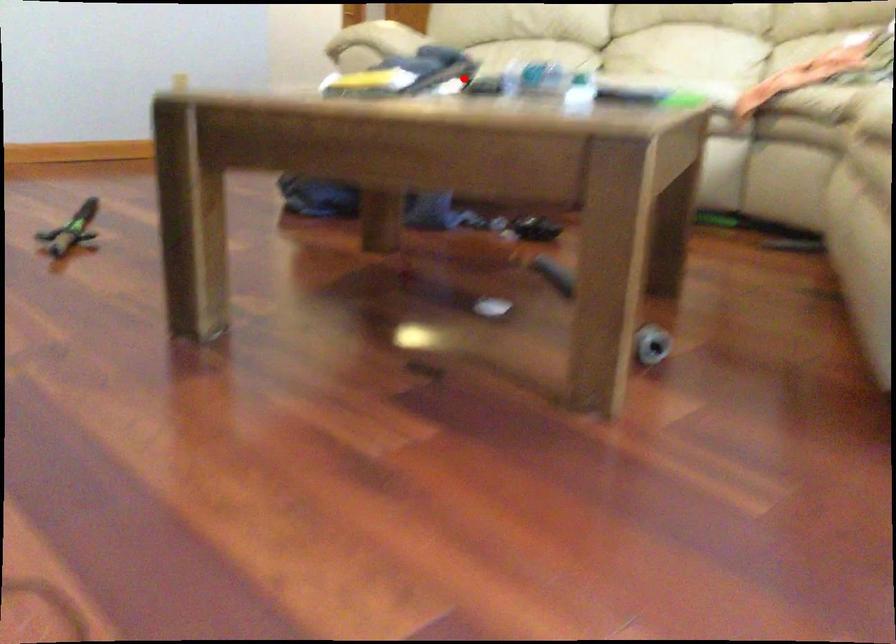
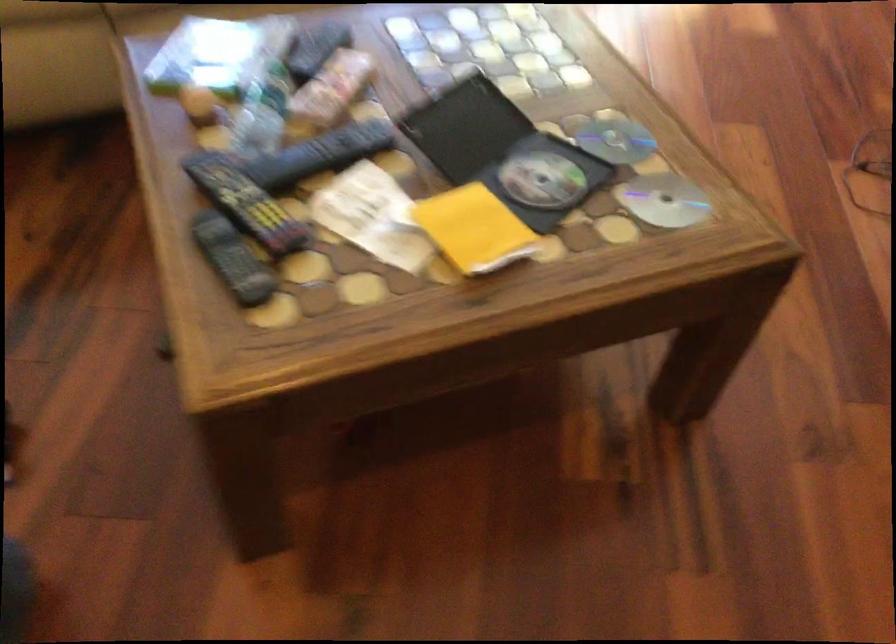
Question: I am providing you with two images of the same scene from different viewpoints. Image1 has a red point marked. In image2, the corresponding 3D location appears at what relative position? Reply with the corresponding letter.

Choices:
 (A) Closer
 (B) Farther

Answer: (A)